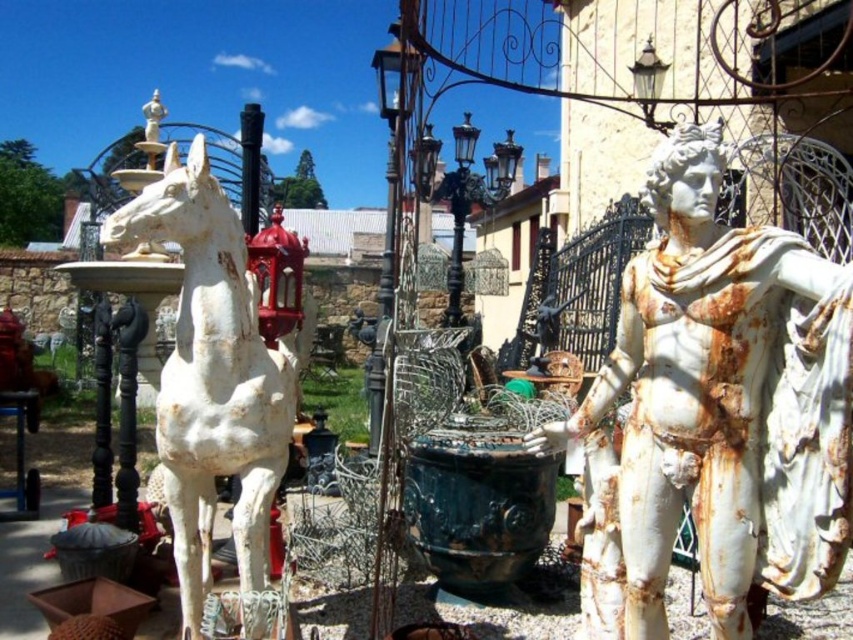
You are standing at the entrance of the flea market and see two points marked in the image. The first point is at coordinate point (715, 504) and the second is at point (280, 474). Which point is closer to you?

Point (715, 504) is in front of point (280, 474), so the first point is closer to you.

You are a customer at the flea market and want to buy both the white marble statue at center and the white matte horse at left. You need to know their arrangement to plan your visit. Which one is located to the right of the other?

The white marble statue at center is positioned on the right side of the white matte horse at left, meaning the white marble statue at center is to the right of the white matte horse at left.